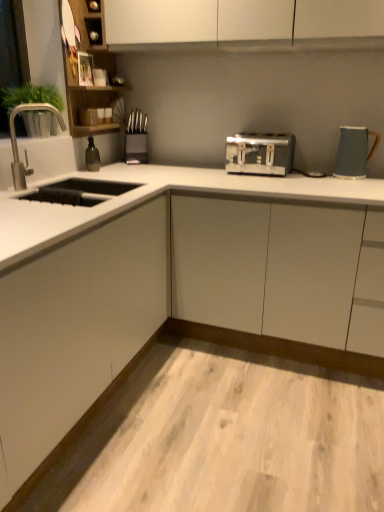
Describe the element at coordinates (25, 150) in the screenshot. I see `silver metallic faucet at left` at that location.

I want to click on silver metallic faucet at left, so click(25, 150).

Identify the location of white laminate countertop at lower center. [x=143, y=289].

The image size is (384, 512). What do you see at coordinates (94, 66) in the screenshot? I see `wooden cabinet at upper left` at bounding box center [94, 66].

At what (x,y) coordinates should I click in order to perform the action: click on white matte cabinet at lower left. Please return your answer as a coordinate pair (x, y). The width and height of the screenshot is (384, 512). Looking at the image, I should click on (76, 330).

Image resolution: width=384 pixels, height=512 pixels. What do you see at coordinates (260, 153) in the screenshot?
I see `satin silver toaster at center` at bounding box center [260, 153].

At what (x,y) coordinates should I click in order to perform the action: click on metallic knife block at center. Please return your answer as a coordinate pair (x, y). Looking at the image, I should click on (136, 148).

Locate an element on the screen. The width and height of the screenshot is (384, 512). silver metallic faucet at left is located at coordinates (25, 150).

Who is taller, matte gray kettle at right or white matte cabinet at lower left?

white matte cabinet at lower left.

Is matte gray kettle at right far from white matte cabinet at lower left?

Indeed, matte gray kettle at right is not near white matte cabinet at lower left.

Looking at their sizes, would you say matte gray kettle at right is wider or thinner than white matte cabinet at lower left?

Clearly, matte gray kettle at right has less width compared to white matte cabinet at lower left.

Considering the points (99, 353) and (131, 307), which point is in front, point (99, 353) or point (131, 307)?

The point (99, 353) is closer to the camera.

Considering the positions of objects white matte cabinet at lower left and white laminate countertop at lower center in the image provided, who is more to the right, white matte cabinet at lower left or white laminate countertop at lower center?

white laminate countertop at lower center.

From a real-world perspective, which is physically above, white matte cabinet at lower left or white laminate countertop at lower center?

From a 3D spatial view, white matte cabinet at lower left is above.

Is silver metallic faucet at left further to camera compared to metallic knife block at center?

No, the depth of silver metallic faucet at left is less than that of metallic knife block at center.

Is metallic knife block at center inside silver metallic faucet at left?

No, silver metallic faucet at left does not contain metallic knife block at center.

Considering the relative sizes of silver metallic faucet at left and metallic knife block at center in the image provided, is silver metallic faucet at left shorter than metallic knife block at center?

Incorrect, the height of silver metallic faucet at left does not fall short of that of metallic knife block at center.

Is silver metallic faucet at left oriented away from metallic knife block at center?

silver metallic faucet at left is not turned away from metallic knife block at center.

Measure the distance from matte gray kettle at right to satin silver toaster at center.

matte gray kettle at right and satin silver toaster at center are 13.74 inches apart.

Choose the correct answer: Is matte gray kettle at right inside satin silver toaster at center or outside it?

matte gray kettle at right cannot be found inside satin silver toaster at center.

Does matte gray kettle at right have a greater width compared to satin silver toaster at center?

Incorrect, the width of matte gray kettle at right does not surpass that of satin silver toaster at center.

In the scene shown: Considering the relative sizes of matte gray kettle at right and satin silver toaster at center in the image provided, is matte gray kettle at right taller than satin silver toaster at center?

Yes.

Does point (13, 135) come farther from viewer compared to point (78, 125)?

No, it is in front of (78, 125).

Can wooden cabinet at upper left be found inside silver metallic faucet at left?

Answer: No, wooden cabinet at upper left is not a part of silver metallic faucet at left.

From the picture: Is white matte cabinet at lower left oriented away from matte gray kettle at right?

No, white matte cabinet at lower left is not facing away from matte gray kettle at right.

Based on the photo, would you say white matte cabinet at lower left is to the left or to the right of matte gray kettle at right in the picture?

white matte cabinet at lower left is positioned on matte gray kettle at right's left side.

Choose the correct answer: Is white matte cabinet at lower left inside matte gray kettle at right or outside it?

white matte cabinet at lower left is outside matte gray kettle at right.

How distant is white matte cabinet at lower left from matte gray kettle at right?

The distance of white matte cabinet at lower left from matte gray kettle at right is 1.26 meters.

Which object is positioned more to the left, wooden cabinet at upper left or silver metallic faucet at left?

silver metallic faucet at left is more to the left.

Based on the photo, considering the sizes of objects wooden cabinet at upper left and silver metallic faucet at left in the image provided, who is smaller, wooden cabinet at upper left or silver metallic faucet at left?

With smaller size is silver metallic faucet at left.

Find the location of a particular element. kitchen appliance behind the white matte cabinet at lower left is located at coordinates (354, 152).

Where is `cabinetry above the white laminate countertop at lower center (from a real-world perspective)`? cabinetry above the white laminate countertop at lower center (from a real-world perspective) is located at coordinates (76, 330).

When comparing their distances from white laminate countertop at lower center, does matte gray kettle at right or green matte plant at left seem closer?

Among the two, matte gray kettle at right is located nearer to white laminate countertop at lower center.

Looking at the image, which one is located closer to silver metallic faucet at left, white matte cabinet at lower left or satin silver toaster at center?

Based on the image, white matte cabinet at lower left appears to be nearer to silver metallic faucet at left.

When comparing their distances from matte gray kettle at right, does white matte cabinet at lower left or white laminate countertop at lower center seem further?

white matte cabinet at lower left lies further to matte gray kettle at right than the other object.

Considering their positions, is white laminate countertop at lower center positioned further to matte gray kettle at right than satin silver toaster at center?

white laminate countertop at lower center is positioned further to the anchor matte gray kettle at right.

Looking at the image, which one is located further to metallic knife block at center, satin silver toaster at center or wooden cabinet at upper left?

Based on the image, satin silver toaster at center appears to be further to metallic knife block at center.

Based on their spatial positions, is white laminate countertop at lower center or white matte cabinet at lower left closer to green matte plant at left?

The object closer to green matte plant at left is white laminate countertop at lower center.

From the image, which object appears to be farther from white matte cabinet at lower left, white laminate countertop at lower center or metallic knife block at center?

Among the two, metallic knife block at center is located further to white matte cabinet at lower left.

From the image, which object appears to be farther from metallic knife block at center, matte gray kettle at right or silver metallic faucet at left?

matte gray kettle at right is further to metallic knife block at center.

Where is `appliance situated between green matte plant at left and satin silver toaster at center from left to right`? appliance situated between green matte plant at left and satin silver toaster at center from left to right is located at coordinates (136, 148).

I want to click on plant positioned between white matte cabinet at lower left and satin silver toaster at center from near to far, so click(x=30, y=96).

Identify the location of tap between satin silver toaster at center and white laminate countertop at lower center vertically. Image resolution: width=384 pixels, height=512 pixels. (25, 150).

Locate an element on the screen. The image size is (384, 512). tap situated between green matte plant at left and satin silver toaster at center from left to right is located at coordinates (25, 150).